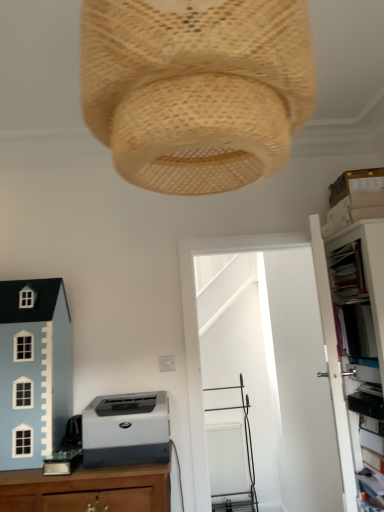
Question: From a real-world perspective, relative to light blue painted wood toy house at lower left, is white plastic file cabinet at right vertically above or below?

Choices:
 (A) below
 (B) above

Answer: (A)

Question: From the image's perspective, is white plastic file cabinet at right above or below light blue painted wood toy house at lower left?

Choices:
 (A) above
 (B) below

Answer: (B)

Question: Which object is positioned closest to the white plastic file cabinet at right?

Choices:
 (A) woven beige lampshade at upper center
 (B) light blue painted wood toy house at lower left
 (C) gray matte printer at lower left

Answer: (C)

Question: Which object is positioned farthest from the gray matte printer at lower left?

Choices:
 (A) white plastic file cabinet at right
 (B) light blue painted wood toy house at lower left
 (C) woven beige lampshade at upper center

Answer: (A)